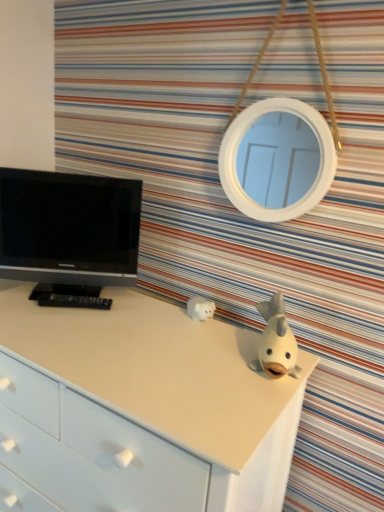
Locate an element on the screen. The height and width of the screenshot is (512, 384). empty space that is in between white matte fish at upper right, arranged as the first toy when viewed from the front, and white matte piggy bank at center, positioned as the second toy in front-to-back order is located at coordinates (237, 340).